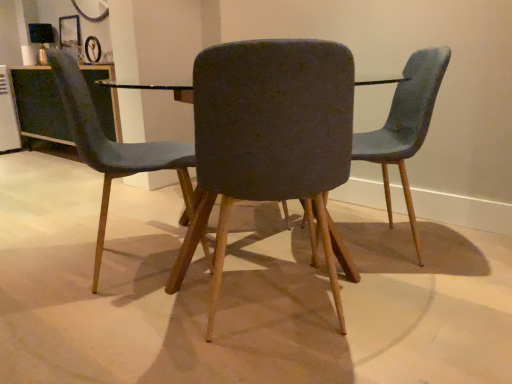
Question: Does point (47, 89) appear closer or farther from the camera than point (11, 132)?

Choices:
 (A) farther
 (B) closer

Answer: (B)

Question: From a real-world perspective, is clear glass table at upper left above or below white plastic appliance at left?

Choices:
 (A) below
 (B) above

Answer: (A)

Question: Which object is the closest to the textured gray chair at center, which is the second chair from right to left?

Choices:
 (A) velvet blue chair at left, the 1th chair in the left-to-right sequence
 (B) white plastic appliance at left
 (C) textured gray chair at center, placed as the 1th chair when sorted from right to left
 (D) clear glass table at upper left
 (E) matte black table at center

Answer: (A)

Question: Estimate the real-world distances between objects in this image. Which object is closer to the textured gray chair at center, which is the second chair from right to left?

Choices:
 (A) clear glass table at upper left
 (B) white plastic appliance at left
 (C) velvet blue chair at left, which appears as the third chair when viewed from the right
 (D) matte black table at center
 (E) textured gray chair at center, placed as the 1th chair when sorted from right to left

Answer: (C)